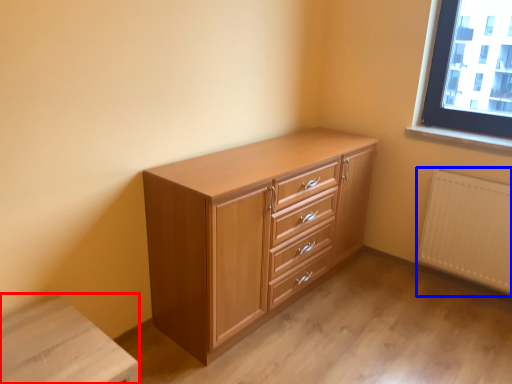
Question: Which of the following is the farthest to the observer, changing table (highlighted by a red box) or radiator (highlighted by a blue box)?

Choices:
 (A) changing table
 (B) radiator

Answer: (B)